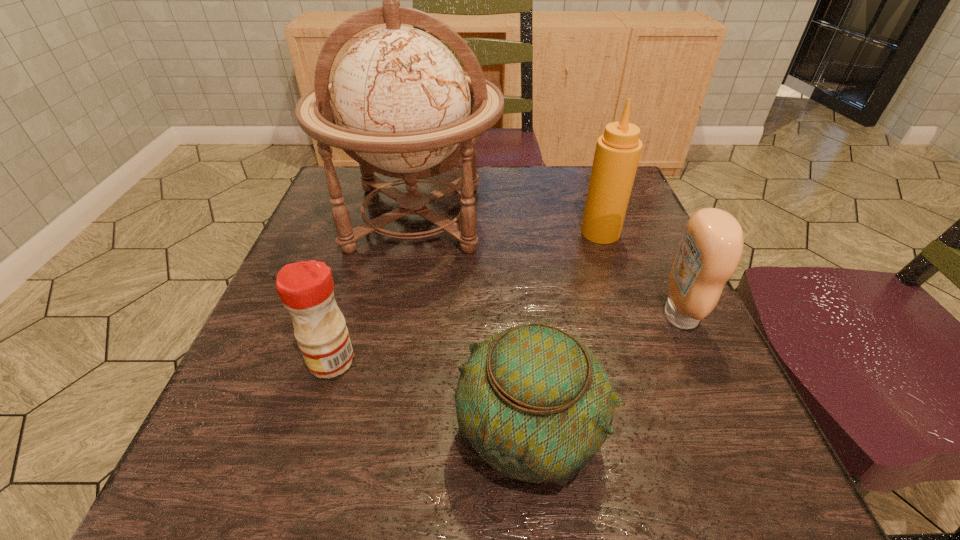
This screenshot has width=960, height=540. Identify the location of vacant space at the near edge. (350, 448).

Find the location of a particular element. The height and width of the screenshot is (540, 960). vacant space at the left edge is located at coordinates (207, 438).

Where is `free space at the right edge of the desktop`? The image size is (960, 540). free space at the right edge of the desktop is located at coordinates (655, 235).

You are a GUI agent. You are given a task and a screenshot of the screen. Output one action in this format:
    pyautogui.click(x=<x>, y=<y>)
    Task: Click on the vacant area at the far left corner of the desktop
    
    Given the screenshot: What is the action you would take?
    pyautogui.click(x=389, y=198)

In the image, there is a desktop. Where is `vacant space at the near left corner`? The image size is (960, 540). vacant space at the near left corner is located at coordinates (231, 496).

At what (x,y) coordinates should I click in order to perform the action: click on vacant area between the tallest object and the second nearest condiment. Please return your answer as a coordinate pair (x, y). This screenshot has height=540, width=960. Looking at the image, I should click on (547, 267).

Find the location of a particular element. vacant point located between the second condiment from left to right and the third farthest object is located at coordinates (640, 274).

I want to click on free spot between the tallest object and the leftmost condiment, so (373, 289).

This screenshot has height=540, width=960. Find the location of `free space between the tallest object and the second farthest condiment`. free space between the tallest object and the second farthest condiment is located at coordinates (547, 267).

What are the coordinates of `unoccupied position between the globe and the pottery` in the screenshot? It's located at (472, 325).